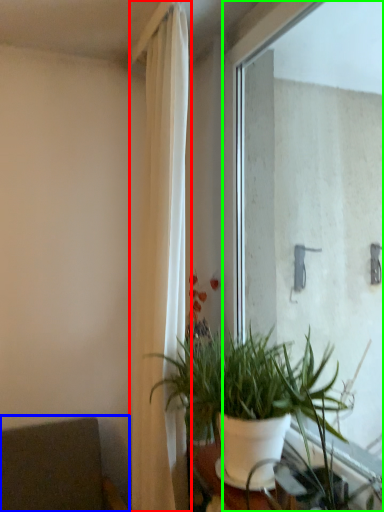
Question: Which object is positioned farthest from curtain (highlighted by a red box)? Select from armchair (highlighted by a blue box) and window (highlighted by a green box).

Choices:
 (A) armchair
 (B) window

Answer: (B)